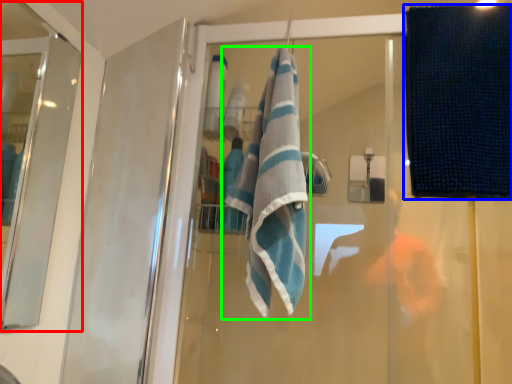
Question: Which object is positioned closest to screen door (highlighted by a red box)? Select from beach towel (highlighted by a blue box) and towel (highlighted by a green box).

Choices:
 (A) beach towel
 (B) towel

Answer: (B)